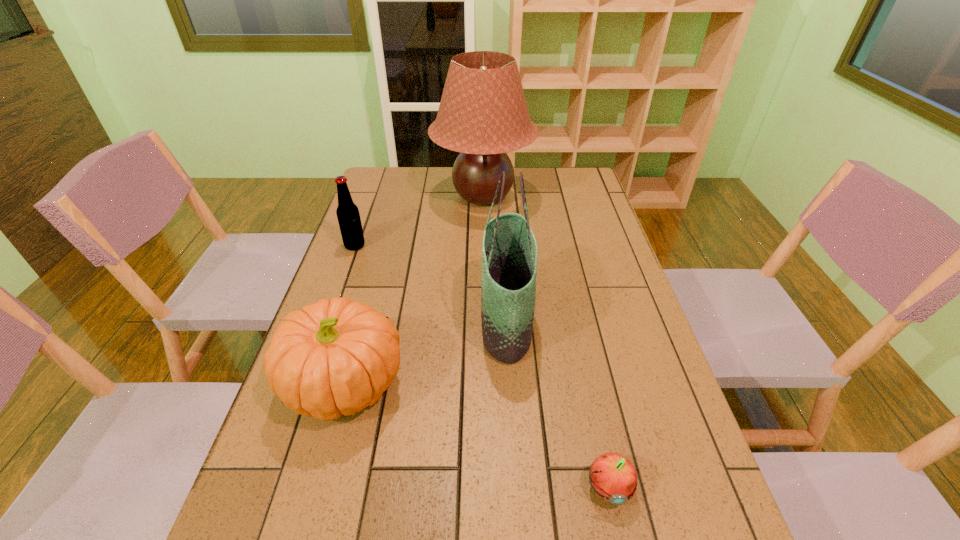
Where is `free region at the far left corner`? The image size is (960, 540). free region at the far left corner is located at coordinates (413, 168).

This screenshot has width=960, height=540. I want to click on empty space between the pumpkin and the tote bag, so click(x=426, y=352).

The height and width of the screenshot is (540, 960). In order to click on vacant space that's between the tote bag and the second farthest object in this screenshot , I will do 430,283.

The width and height of the screenshot is (960, 540). Identify the location of free space between the tote bag and the pumpkin. (426, 352).

Where is `vacant area between the pumpkin and the nearest object`? vacant area between the pumpkin and the nearest object is located at coordinates (477, 436).

Identify the location of vacant space that's between the beer bottle and the nearest object. This screenshot has height=540, width=960. (481, 367).

At what (x,y) coordinates should I click in order to perform the action: click on vacant area that lies between the tote bag and the fourth nearest object. Please return your answer as a coordinate pair (x, y). This screenshot has width=960, height=540. Looking at the image, I should click on (430, 283).

Image resolution: width=960 pixels, height=540 pixels. Find the location of `free spot between the pumpkin and the lampshade`. free spot between the pumpkin and the lampshade is located at coordinates (415, 291).

Locate an element on the screen. The image size is (960, 540). free point between the tote bag and the pumpkin is located at coordinates click(426, 352).

Where is `vacant space in between the nearest object and the tote bag`? The height and width of the screenshot is (540, 960). vacant space in between the nearest object and the tote bag is located at coordinates tap(557, 403).